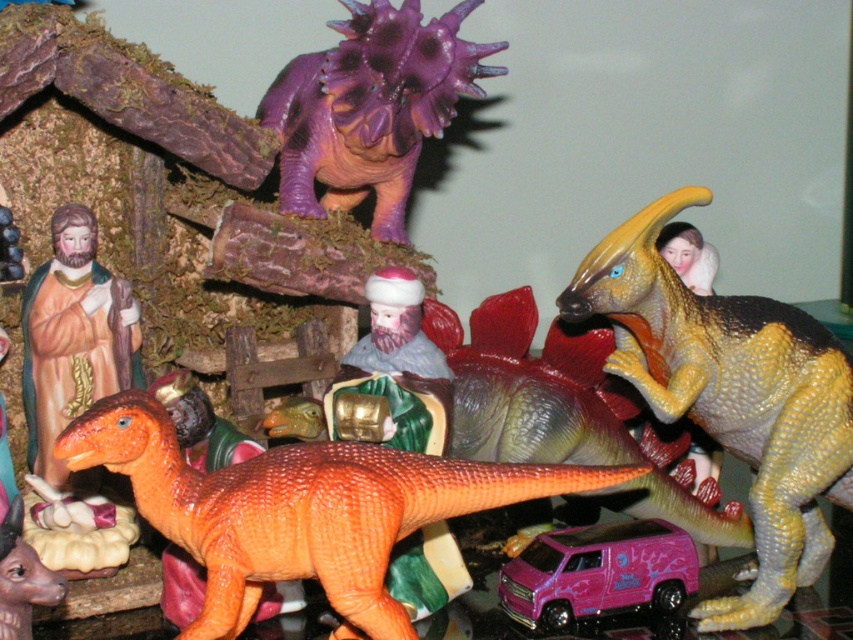
Question: Which object is closer to the camera taking this photo?

Choices:
 (A) orange matte plastic dinosaur at center
 (B) matte plastic figure at center
 (C) porcelain figure at left
 (D) yellow matte parasaurolophus at upper right

Answer: (A)

Question: Which object appears farthest from the camera in this image?

Choices:
 (A) orange matte plastic dinosaur at center
 (B) pink plastic van at lower center
 (C) purple matte stegosaurus at upper center

Answer: (C)

Question: Is orange matte plastic dinosaur at center bigger than porcelain figure at left?

Choices:
 (A) yes
 (B) no

Answer: (A)

Question: Observing the image, what is the correct spatial positioning of orange matte plastic dinosaur at center in reference to matte plastic figure at center?

Choices:
 (A) below
 (B) above

Answer: (A)

Question: Does orange matte plastic dinosaur at center appear on the left side of matte plastic figure at center?

Choices:
 (A) yes
 (B) no

Answer: (A)

Question: Among these points, which one is nearest to the camera?

Choices:
 (A) (386, 328)
 (B) (595, 577)
 (C) (381, 458)
 (D) (704, 196)

Answer: (C)